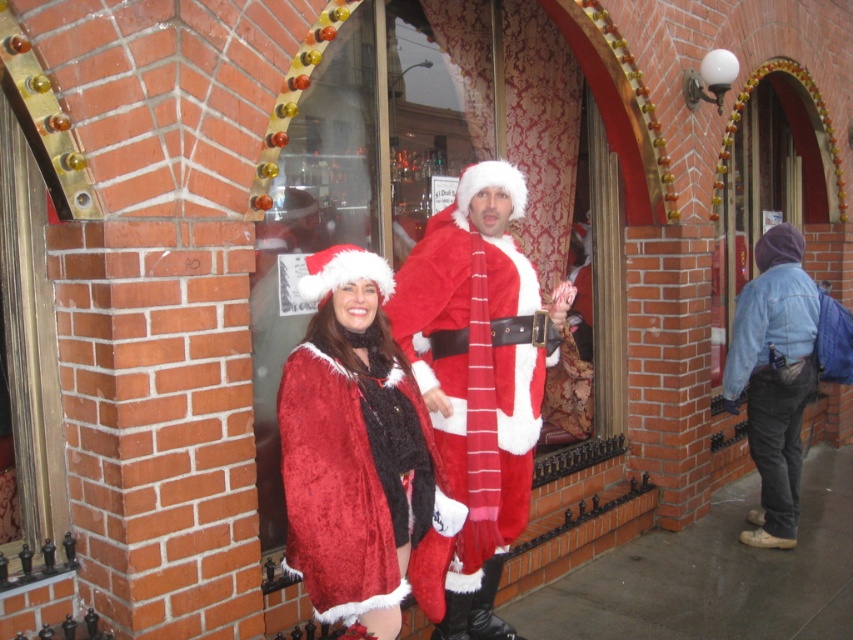
Who is positioned more to the left, fuzzy red santa suit at center or fuzzy red coat at center?

From the viewer's perspective, fuzzy red coat at center appears more on the left side.

Which is above, fuzzy red santa suit at center or fuzzy red coat at center?

fuzzy red santa suit at center is above.

Identify the location of fuzzy red santa suit at center. (479, 378).

Which is more to the left, fuzzy red santa suit at center or denim jacket at lower right?

fuzzy red santa suit at center

Can you confirm if fuzzy red santa suit at center is positioned to the left of denim jacket at lower right?

Correct, you'll find fuzzy red santa suit at center to the left of denim jacket at lower right.

Which is behind, point (421, 252) or point (747, 346)?

The point (747, 346) is behind.

Find the location of `fuzzy red santa suit at center`. fuzzy red santa suit at center is located at coordinates (479, 378).

Does velvet santa suit at center have a smaller size compared to denim jacket at lower right?

No, velvet santa suit at center is not smaller than denim jacket at lower right.

How much distance is there between velvet santa suit at center and denim jacket at lower right?

velvet santa suit at center is 5.47 feet from denim jacket at lower right.

The image size is (853, 640). What are the coordinates of `velvet santa suit at center` in the screenshot? It's located at (364, 170).

What are the coordinates of `velvet santa suit at center` in the screenshot? It's located at (364, 170).